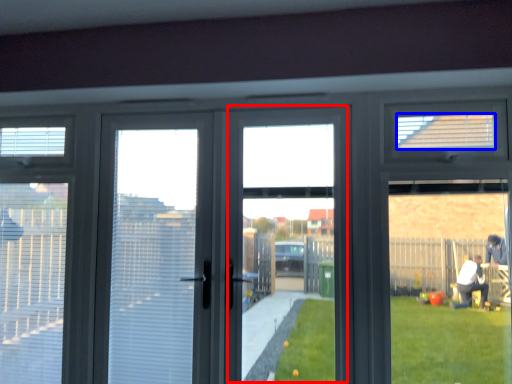
Question: Which object is further to the camera taking this photo, window screen (highlighted by a red box) or blind (highlighted by a blue box)?

Choices:
 (A) window screen
 (B) blind

Answer: (B)